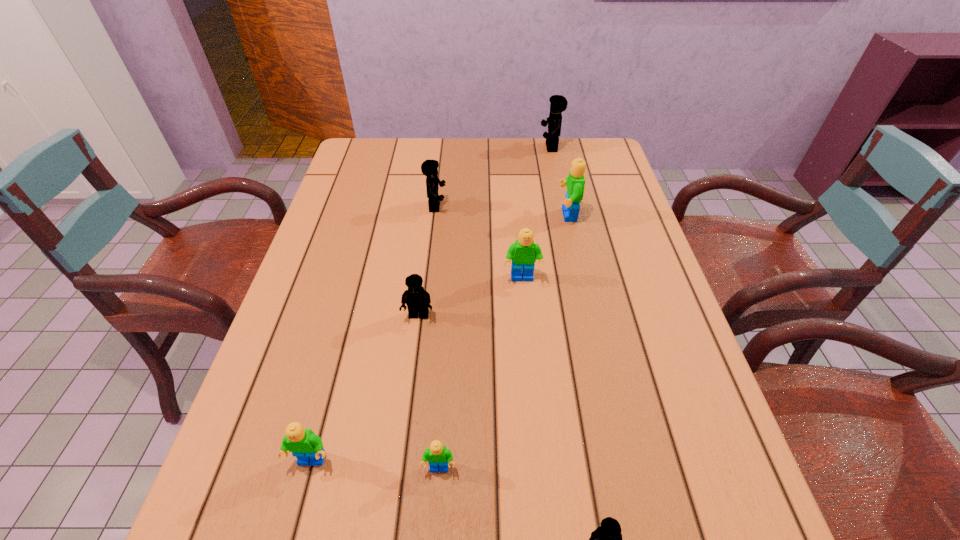
You are a GUI agent. You are given a task and a screenshot of the screen. Output one action in this format:
    pyautogui.click(x=<x>, y=<y>)
    Task: Click on the third biggest green Lego
    The width and height of the screenshot is (960, 540).
    Given the screenshot: What is the action you would take?
    pyautogui.click(x=305, y=445)

Find the location of a particular element. The width and height of the screenshot is (960, 540). the second green Lego from left to right is located at coordinates (439, 458).

Where is `vacant space situated 0.060m on the front-facing side of the biggest yellow Lego`? vacant space situated 0.060m on the front-facing side of the biggest yellow Lego is located at coordinates (522, 147).

In order to click on free space located on the front-facing side of the biggest yellow Lego in this screenshot , I will do `click(516, 147)`.

Where is `free space located 0.190m on the front-facing side of the biggest yellow Lego`? This screenshot has height=540, width=960. free space located 0.190m on the front-facing side of the biggest yellow Lego is located at coordinates (484, 147).

The height and width of the screenshot is (540, 960). Find the location of `free space located 0.060m on the face of the biggest green Lego`. free space located 0.060m on the face of the biggest green Lego is located at coordinates pos(537,215).

Identify the location of free spot located on the face of the biggest green Lego. (522, 215).

Find the location of `free spot located on the face of the biggest green Lego`. free spot located on the face of the biggest green Lego is located at coordinates (494, 215).

Image resolution: width=960 pixels, height=540 pixels. In order to click on free space located 0.390m on the front-facing side of the third nearest yellow Lego in this screenshot , I will do `click(581, 207)`.

Image resolution: width=960 pixels, height=540 pixels. What are the coordinates of `free region located on the face of the fifth nearest object` in the screenshot? It's located at (531, 372).